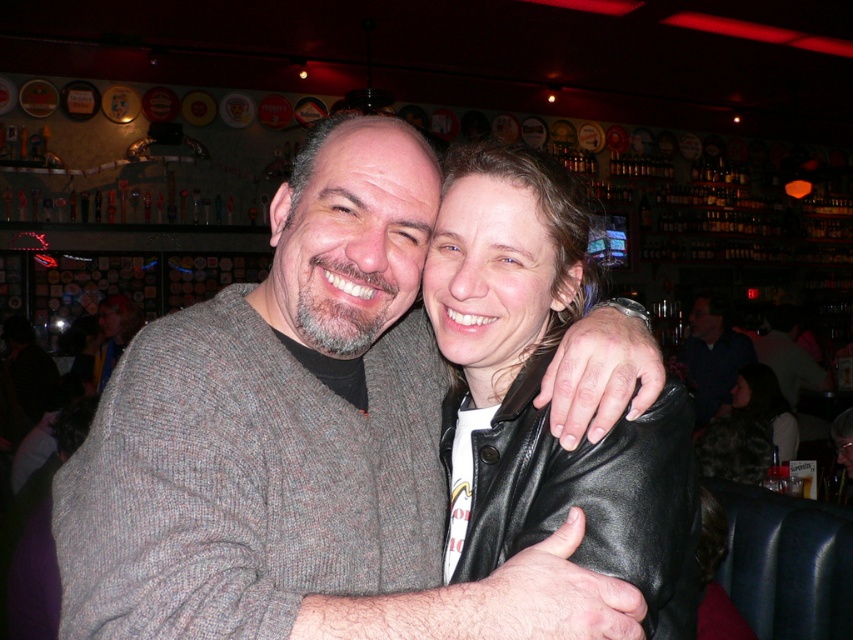
Which is more to the right, black leather jacket at lower right or dark blue shirt at center?

Positioned to the right is dark blue shirt at center.

Is point (709, 461) less distant than point (709, 337)?

Yes, point (709, 461) is in front of point (709, 337).

Where is `black leather jacket at lower right`? The width and height of the screenshot is (853, 640). black leather jacket at lower right is located at coordinates pyautogui.click(x=749, y=429).